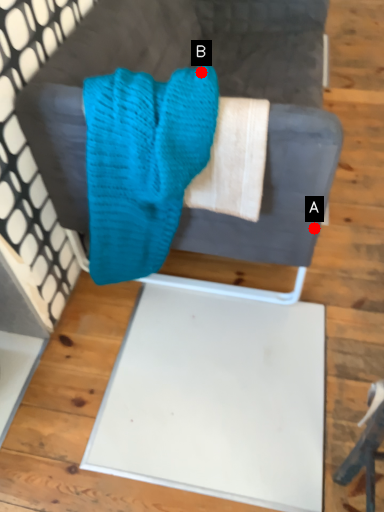
Question: Two points are circled on the image, labeled by A and B beside each circle. Which point is farther from the camera taking this photo?

Choices:
 (A) A is further
 (B) B is further

Answer: (A)